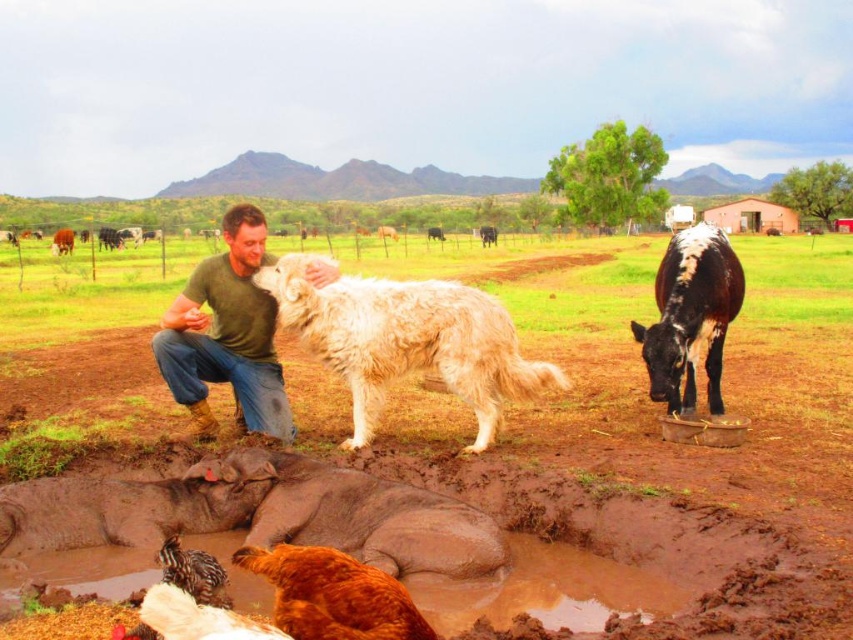
You are standing in the farm scene and want to walk from point A to point B. Point A is at coordinate point [660,268] and point B is at coordinate point [207,586]. Which point is closer to you when you start walking?

Point B at coordinate point [207,586] is closer to you because it is nearer to the camera than point A at coordinate point [660,268].

You are standing in the middle of the farm scene and want to walk towards the black and white cow at center. Which direction should you move relative to the brown soil at center?

The brown soil at center is positioned on the left side of the black and white cow at center, so to reach the cow, you should move to the right side of the brown soil at center.